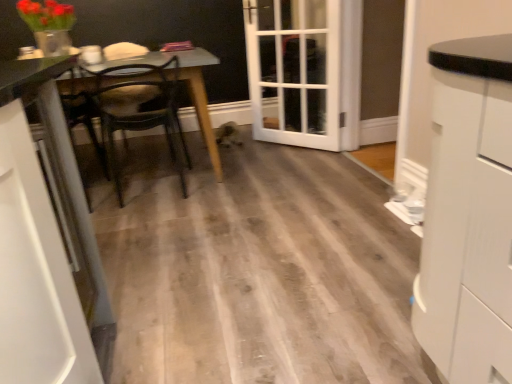
Question: From a real-world perspective, relative to white glass door at center, is wooden table at left vertically above or below?

Choices:
 (A) above
 (B) below

Answer: (B)

Question: In terms of height, does wooden table at left look taller or shorter compared to white glass door at center?

Choices:
 (A) short
 (B) tall

Answer: (A)

Question: Estimate the real-world distances between objects in this image. Which object is farther from the white glossy cabinet at left, which ranks as the second cabinetry in right-to-left order?

Choices:
 (A) wooden table at left
 (B) wooden chair at center
 (C) white glass door at center
 (D) white matte cabinet at right, arranged as the first cabinetry when viewed from the right

Answer: (C)

Question: Which object is positioned closest to the white glass door at center?

Choices:
 (A) white matte cabinet at right, arranged as the first cabinetry when viewed from the right
 (B) wooden table at left
 (C) white glossy cabinet at left, which ranks as the second cabinetry in right-to-left order
 (D) wooden chair at center

Answer: (D)